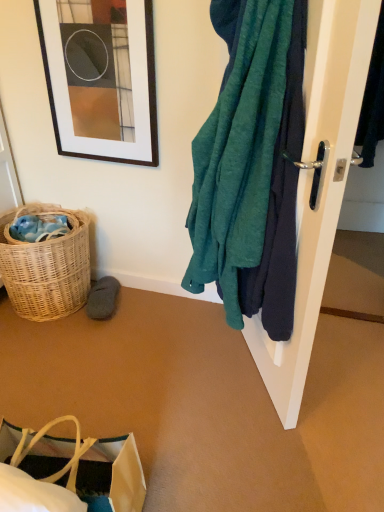
This screenshot has width=384, height=512. Identify the location of brown paper bag at lower left. pos(67,471).

What is the approximate height of teal fabric towel at right?

teal fabric towel at right is 1.04 meters tall.

This screenshot has width=384, height=512. Find the location of `gray suede slipper at lower left`. gray suede slipper at lower left is located at coordinates (103, 298).

From a real-world perspective, is brown paper bag at lower left positioned over woven wicker basket at lower left based on gravity?

Actually, brown paper bag at lower left is physically below woven wicker basket at lower left in the real world.

Is brown paper bag at lower left positioned with its back to woven wicker basket at lower left?

brown paper bag at lower left is not turned away from woven wicker basket at lower left.

Which of these two, brown paper bag at lower left or woven wicker basket at lower left, stands taller?

woven wicker basket at lower left is taller.

Considering the relative sizes of woven wicker basket at lower left and gray suede slipper at lower left in the image provided, is woven wicker basket at lower left shorter than gray suede slipper at lower left?

No.

Does woven wicker basket at lower left turn towards gray suede slipper at lower left?

No, woven wicker basket at lower left is not oriented towards gray suede slipper at lower left.

From a real-world perspective, which object rests below the other?

In real-world perspective, gray suede slipper at lower left is lower.

Looking at their sizes, would you say woven wicker basket at lower left is wider or thinner than gray suede slipper at lower left?

Clearly, woven wicker basket at lower left has more width compared to gray suede slipper at lower left.

Does matte black picture frame at upper left have a lesser width compared to teal fabric towel at right?

Yes.

Where is `picture frame on the left side of teal fabric towel at right`? This screenshot has width=384, height=512. picture frame on the left side of teal fabric towel at right is located at coordinates (101, 78).

Does matte black picture frame at upper left contain teal fabric towel at right?

Actually, teal fabric towel at right is outside matte black picture frame at upper left.

Who is bigger, matte black picture frame at upper left or teal fabric towel at right?

Bigger between the two is teal fabric towel at right.

From a real-world perspective, is teal fabric towel at right physically below matte black picture frame at upper left?

Indeed, from a real-world perspective, teal fabric towel at right is positioned beneath matte black picture frame at upper left.

How different are the orientations of teal fabric towel at right and matte black picture frame at upper left in degrees?

teal fabric towel at right and matte black picture frame at upper left are facing 69.3 degrees away from each other.

Can you confirm if teal fabric towel at right is taller than matte black picture frame at upper left?

Yes, teal fabric towel at right is taller than matte black picture frame at upper left.

Find the location of a particular element. This screenshot has width=384, height=512. picture frame that is above the teal fabric towel at right (from a real-world perspective) is located at coordinates (101, 78).

Can you confirm if gray suede slipper at lower left is positioned to the left of teal fabric towel at right?

Yes, gray suede slipper at lower left is to the left of teal fabric towel at right.

How different are the orientations of gray suede slipper at lower left and teal fabric towel at right in degrees?

The angular difference between gray suede slipper at lower left and teal fabric towel at right is 84 degrees.

From the image's perspective, is gray suede slipper at lower left located above teal fabric towel at right?

No, from the image's perspective, gray suede slipper at lower left is not above teal fabric towel at right.

Is gray suede slipper at lower left shorter than teal fabric towel at right?

Indeed, gray suede slipper at lower left has a lesser height compared to teal fabric towel at right.

Is point (110, 276) positioned after point (52, 481)?

Yes, point (110, 276) is farther from viewer.

At what (x,y) coordinates should I click in order to perform the action: click on handbag on the right of the gray suede slipper at lower left. Please return your answer as a coordinate pair (x, y). The width and height of the screenshot is (384, 512). Looking at the image, I should click on (67, 471).

Which object is thinner, gray suede slipper at lower left or brown paper bag at lower left?

With smaller width is gray suede slipper at lower left.

Considering the sizes of objects woven wicker basket at lower left and white glossy door handle at right in the image provided, who is thinner, woven wicker basket at lower left or white glossy door handle at right?

white glossy door handle at right.

From the image's perspective, which is above, woven wicker basket at lower left or white glossy door handle at right?

white glossy door handle at right is shown above in the image.

What's the angular difference between woven wicker basket at lower left and white glossy door handle at right's facing directions?

The facing directions of woven wicker basket at lower left and white glossy door handle at right are 69.9 degrees apart.

From a real-world perspective, between woven wicker basket at lower left and white glossy door handle at right, who is vertically lower?

woven wicker basket at lower left, from a real-world perspective.

Image resolution: width=384 pixels, height=512 pixels. What are the coordinates of `picnic basket behind the brown paper bag at lower left` in the screenshot? It's located at pos(46,266).

Find the location of a particular element. picnic basket in front of the gray suede slipper at lower left is located at coordinates (46, 266).

Considering their positions, is white glossy door handle at right positioned further to teal fabric towel at right than woven wicker basket at lower left?

Among the two, woven wicker basket at lower left is located further to teal fabric towel at right.

Considering their positions, is woven wicker basket at lower left positioned closer to teal fabric towel at right than brown paper bag at lower left?

brown paper bag at lower left.

From the image, which object appears to be nearer to woven wicker basket at lower left, matte black picture frame at upper left or brown paper bag at lower left?

The object closer to woven wicker basket at lower left is matte black picture frame at upper left.

Estimate the real-world distances between objects in this image. Which object is closer to white glossy door handle at right, brown paper bag at lower left or gray suede slipper at lower left?

brown paper bag at lower left is positioned closer to the anchor white glossy door handle at right.

Looking at the image, which one is located closer to matte black picture frame at upper left, woven wicker basket at lower left or teal fabric towel at right?

woven wicker basket at lower left lies closer to matte black picture frame at upper left than the other object.

Considering their positions, is teal fabric towel at right positioned closer to gray suede slipper at lower left than white glossy door handle at right?

white glossy door handle at right.

Considering their positions, is woven wicker basket at lower left positioned further to matte black picture frame at upper left than white glossy door handle at right?

white glossy door handle at right is positioned further to the anchor matte black picture frame at upper left.

Which object lies nearer to the anchor point teal fabric towel at right, woven wicker basket at lower left or matte black picture frame at upper left?

matte black picture frame at upper left is positioned closer to the anchor teal fabric towel at right.

Find the location of a particular element. picnic basket between matte black picture frame at upper left and brown paper bag at lower left in the vertical direction is located at coordinates (46, 266).

Image resolution: width=384 pixels, height=512 pixels. Identify the location of handbag between teal fabric towel at right and woven wicker basket at lower left in the front-back direction. (67, 471).

The width and height of the screenshot is (384, 512). I want to click on door between teal fabric towel at right and brown paper bag at lower left in the vertical direction, so click(319, 184).

Locate an element on the screen. Image resolution: width=384 pixels, height=512 pixels. picnic basket between brown paper bag at lower left and gray suede slipper at lower left from front to back is located at coordinates (46, 266).